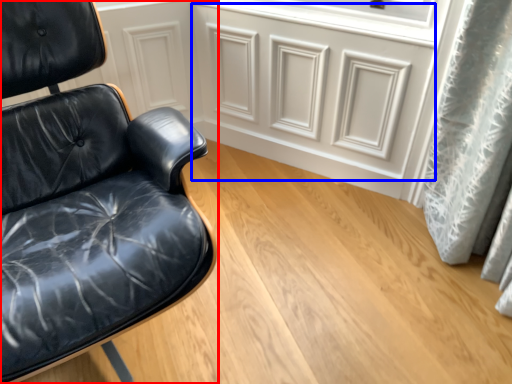
Question: Which object appears farthest to the camera in this image, chair (highlighted by a red box) or drawer (highlighted by a blue box)?

Choices:
 (A) chair
 (B) drawer

Answer: (B)